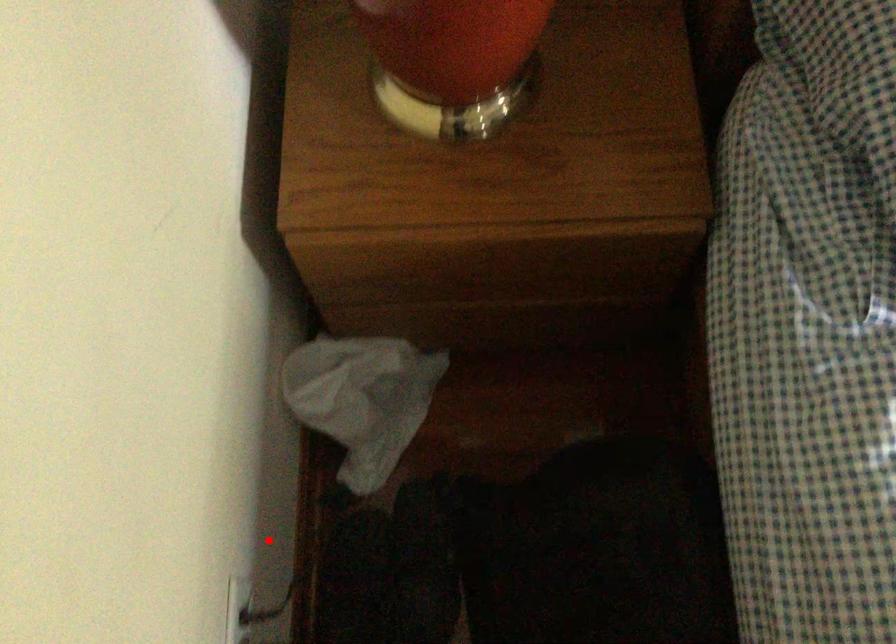
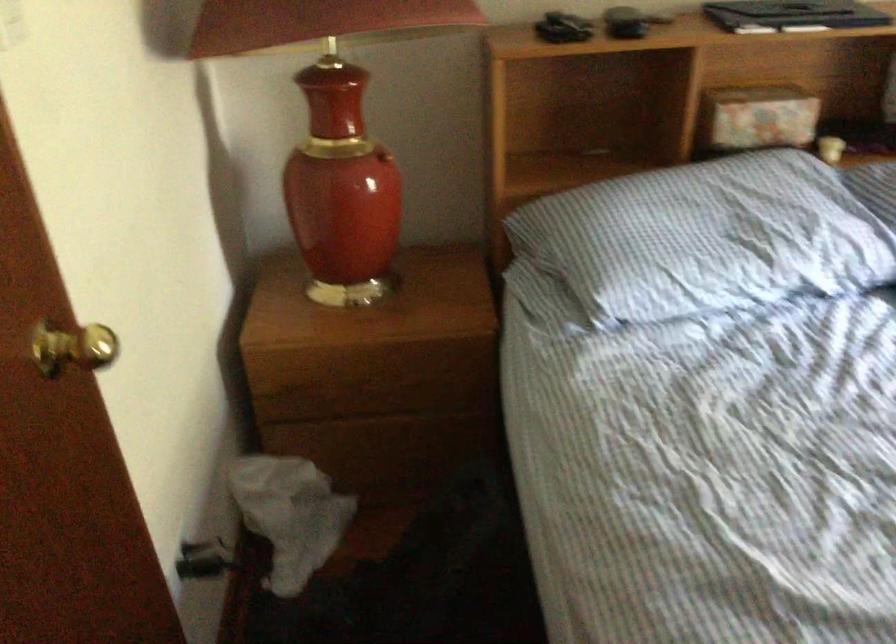
Question: I am providing you with two images of the same scene from different viewpoints. A red point is shown in image1. For the corresponding object point in image2, is it positioned nearer or farther from the camera?

Choices:
 (A) Nearer
 (B) Farther

Answer: (B)